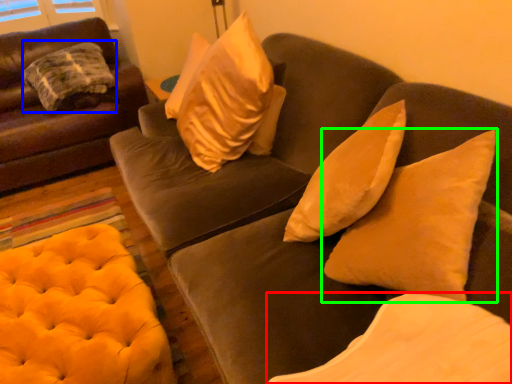
Question: Considering the real-world distances, which object is farthest from pillow (highlighted by a red box)? pillow (highlighted by a blue box) or pillow (highlighted by a green box)?

Choices:
 (A) pillow
 (B) pillow

Answer: (A)